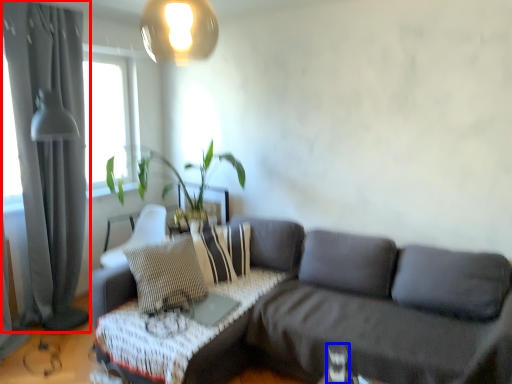
Question: Which object is further to the camera taking this photo, curtain (highlighted by a red box) or table lamp (highlighted by a blue box)?

Choices:
 (A) curtain
 (B) table lamp

Answer: (A)